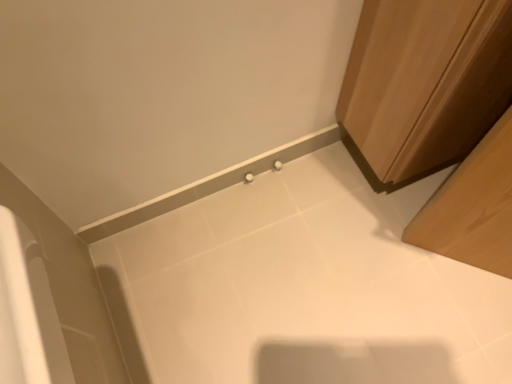
Image resolution: width=512 pixels, height=384 pixels. What do you see at coordinates (302, 288) in the screenshot? I see `white glossy porcelain at center` at bounding box center [302, 288].

At what (x,y) coordinates should I click in order to perform the action: click on white glossy porcelain at center. Please return your answer as a coordinate pair (x, y). Looking at the image, I should click on (302, 288).

Find the location of `white glossy porcelain at center`. white glossy porcelain at center is located at coordinates (302, 288).